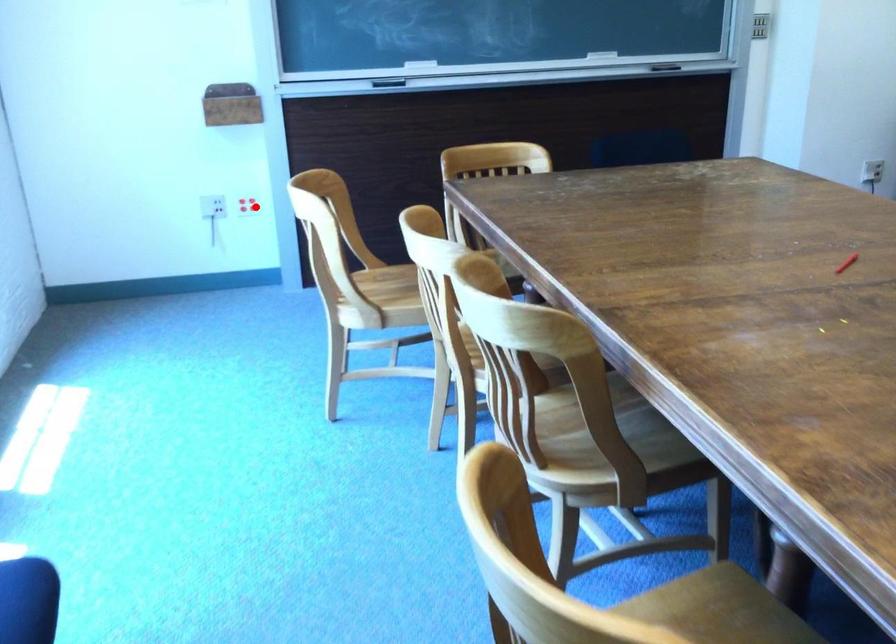
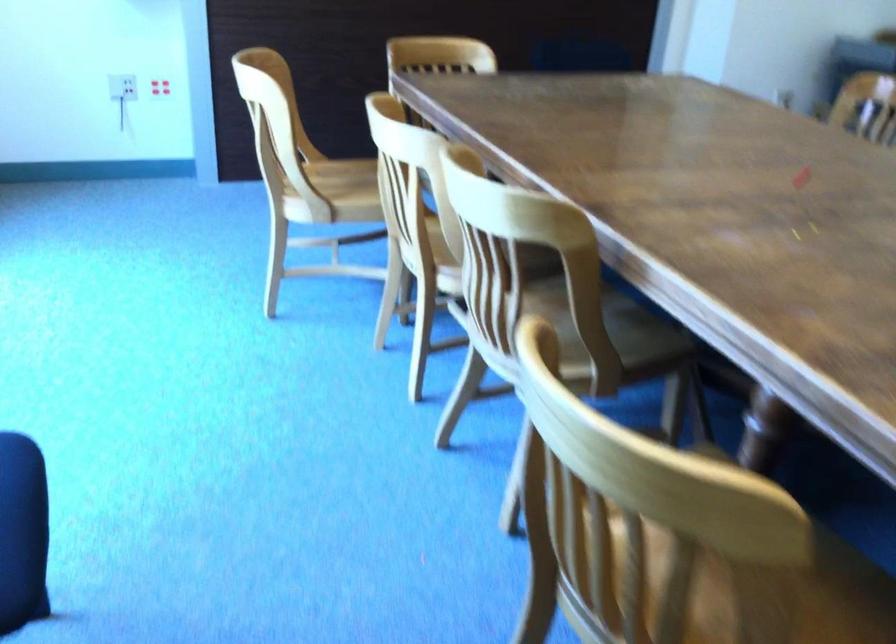
Locate, in the second image, the point that corresponds to the highlighted location in the first image.

(159, 87)